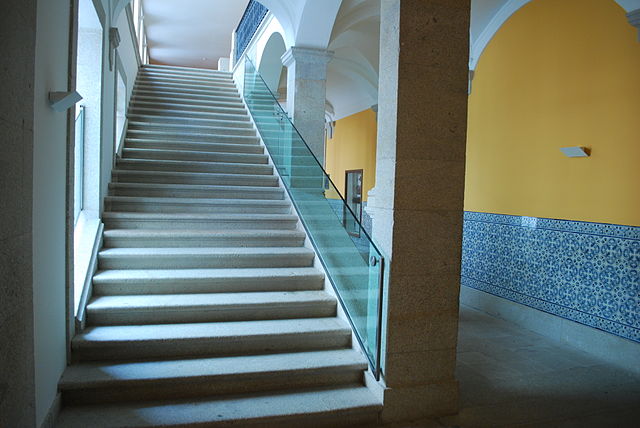
Locate an element on the screen. The image size is (640, 428). window on the left side is located at coordinates (77, 168), (120, 109).